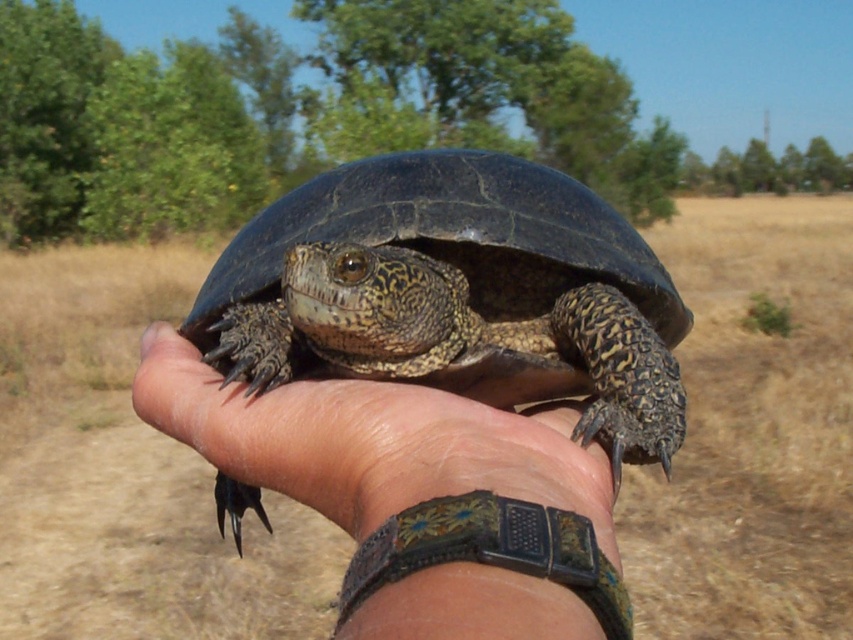
Question: Which of the following is the farthest from the observer?

Choices:
 (A) (514, 388)
 (B) (218, 400)

Answer: (A)

Question: Does shiny dark shell turtle at center have a greater width compared to leather wristwatch at center?

Choices:
 (A) yes
 (B) no

Answer: (A)

Question: Does shiny dark shell turtle at center have a smaller size compared to leather wristwatch at center?

Choices:
 (A) yes
 (B) no

Answer: (B)

Question: Does shiny dark shell turtle at center appear on the right side of leather wristwatch at center?

Choices:
 (A) yes
 (B) no

Answer: (B)

Question: Which point is closer to the camera taking this photo?

Choices:
 (A) tap(496, 326)
 (B) tap(320, 417)

Answer: (B)